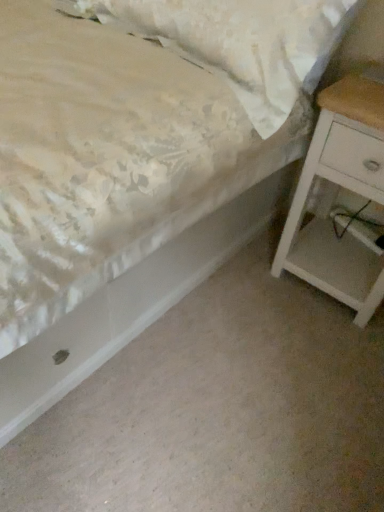
Image resolution: width=384 pixels, height=512 pixels. Find the location of `white matte nightstand at right`. white matte nightstand at right is located at coordinates (342, 187).

Measure the distance between white matte nightstand at right and camera.

The distance of white matte nightstand at right from camera is 3.33 feet.

In order to face white matte nightstand at right, should I rotate leftwards or rightwards?

To align with it, rotate right about 22.887°.

The height and width of the screenshot is (512, 384). Describe the element at coordinates (342, 187) in the screenshot. I see `white matte nightstand at right` at that location.

What is the approximate height of white matte nightstand at right?

The height of white matte nightstand at right is 26.34 inches.

Image resolution: width=384 pixels, height=512 pixels. Describe the element at coordinates (241, 42) in the screenshot. I see `floral fabric pillow at upper left` at that location.

You are a GUI agent. You are given a task and a screenshot of the screen. Output one action in this format:
    pyautogui.click(x=<x>, y=<y>)
    Task: Click on the floral fabric pillow at upper left
    
    Given the screenshot: What is the action you would take?
    pyautogui.click(x=241, y=42)

This screenshot has height=512, width=384. I want to click on white matte nightstand at right, so click(x=342, y=187).

Which is more to the right, floral fabric pillow at upper left or white matte nightstand at right?

white matte nightstand at right.

Considering the relative positions of floral fabric pillow at upper left and white matte nightstand at right in the image provided, is floral fabric pillow at upper left behind white matte nightstand at right?

No, floral fabric pillow at upper left is in front of white matte nightstand at right.

Between point (244, 44) and point (292, 243), which one is positioned in front?

Point (244, 44)

From the image's perspective, who appears lower, floral fabric pillow at upper left or white matte nightstand at right?

white matte nightstand at right.

From a real-world perspective, between floral fabric pillow at upper left and white matte nightstand at right, who is vertically lower?

white matte nightstand at right is physically lower.

Considering the relative sizes of floral fabric pillow at upper left and white matte nightstand at right in the image provided, is floral fabric pillow at upper left wider than white matte nightstand at right?

Incorrect, the width of floral fabric pillow at upper left does not surpass that of white matte nightstand at right.

Who is shorter, floral fabric pillow at upper left or white matte nightstand at right?

With less height is floral fabric pillow at upper left.

Considering the sizes of floral fabric pillow at upper left and white matte nightstand at right in the image, is floral fabric pillow at upper left bigger or smaller than white matte nightstand at right?

Considering their sizes, floral fabric pillow at upper left takes up more space than white matte nightstand at right.

Is white matte nightstand at right inside floral fabric pillow at upper left?

Actually, white matte nightstand at right is outside floral fabric pillow at upper left.

In the scene shown: Is floral fabric pillow at upper left placed right next to white matte nightstand at right?

No.

Based on the photo, is floral fabric pillow at upper left facing away from white matte nightstand at right?

That's not correct — floral fabric pillow at upper left is not looking away from white matte nightstand at right.

How distant is floral fabric pillow at upper left from white matte nightstand at right?

floral fabric pillow at upper left and white matte nightstand at right are 34.65 centimeters apart from each other.

Find the location of a particular element. pillow that is in front of the white matte nightstand at right is located at coordinates (241, 42).

Between white matte nightstand at right and floral fabric pillow at upper left, which one appears on the left side from the viewer's perspective?

floral fabric pillow at upper left is more to the left.

Is the position of white matte nightstand at right less distant than that of floral fabric pillow at upper left?

That is False.

Which is closer to the camera, (371, 100) or (329, 21)?

The point (329, 21) is closer to the camera.

From the image's perspective, is white matte nightstand at right above or below floral fabric pillow at upper left?

white matte nightstand at right is below floral fabric pillow at upper left.

From a real-world perspective, relative to floral fabric pillow at upper left, is white matte nightstand at right vertically above or below?

From a real-world perspective, white matte nightstand at right is physically below floral fabric pillow at upper left.

Does white matte nightstand at right have a lesser width compared to floral fabric pillow at upper left?

Incorrect, the width of white matte nightstand at right is not less than that of floral fabric pillow at upper left.

Is white matte nightstand at right taller or shorter than floral fabric pillow at upper left?

Result: white matte nightstand at right is taller than floral fabric pillow at upper left.

Looking at the image, does white matte nightstand at right seem bigger or smaller compared to floral fabric pillow at upper left?

white matte nightstand at right is smaller than floral fabric pillow at upper left.

Which is correct: white matte nightstand at right is inside floral fabric pillow at upper left, or outside of it?

white matte nightstand at right is spatially situated outside floral fabric pillow at upper left.

Looking at this image, are white matte nightstand at right and floral fabric pillow at upper left beside each other?

No.

Is floral fabric pillow at upper left at the back of white matte nightstand at right?

No, floral fabric pillow at upper left is not at the back of white matte nightstand at right.

Measure the distance from white matte nightstand at right to floral fabric pillow at upper left.

A distance of 13.64 inches exists between white matte nightstand at right and floral fabric pillow at upper left.

Where is `nightstand below the floral fabric pillow at upper left (from a real-world perspective)`? This screenshot has height=512, width=384. nightstand below the floral fabric pillow at upper left (from a real-world perspective) is located at coordinates (342, 187).

Where is `nightstand behind the floral fabric pillow at upper left`? nightstand behind the floral fabric pillow at upper left is located at coordinates [x=342, y=187].

Where is `nightstand below the floral fabric pillow at upper left (from a real-world perspective)`? The height and width of the screenshot is (512, 384). nightstand below the floral fabric pillow at upper left (from a real-world perspective) is located at coordinates (342, 187).